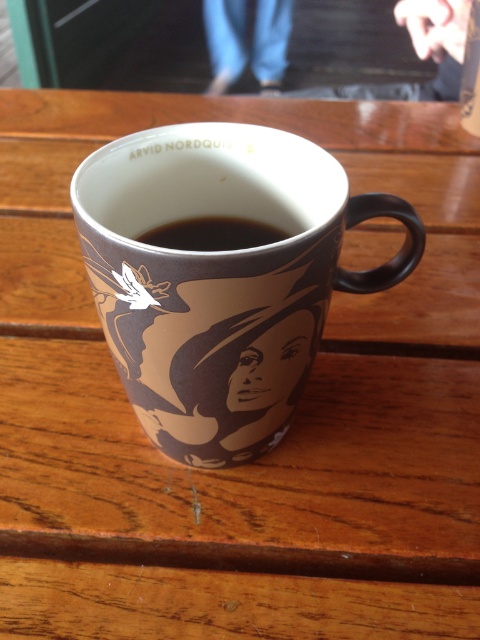
Question: Where is black glossy coffee at center located in relation to black glossy coffee cup at center in the image?

Choices:
 (A) left
 (B) right

Answer: (A)

Question: Which of these objects is positioned farthest from the black glossy coffee at center?

Choices:
 (A) black glossy coffee cup at center
 (B) brown matte mug at center

Answer: (A)

Question: Does brown matte mug at center come behind black glossy coffee cup at center?

Choices:
 (A) yes
 (B) no

Answer: (B)

Question: Which point is farther from the camera taking this photo?

Choices:
 (A) (133, 188)
 (B) (251, 244)

Answer: (B)

Question: Does brown matte mug at center appear on the right side of black glossy coffee at center?

Choices:
 (A) no
 (B) yes

Answer: (B)

Question: Among these points, which one is farthest from the camera?

Choices:
 (A) (472, 45)
 (B) (251, 221)

Answer: (A)